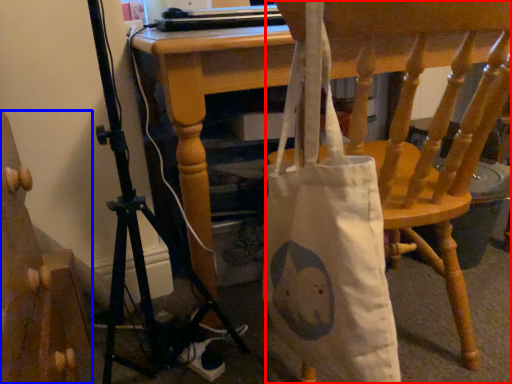
Question: Which object appears farthest to the camera in this image, chair (highlighted by a red box) or furniture (highlighted by a blue box)?

Choices:
 (A) chair
 (B) furniture

Answer: (A)